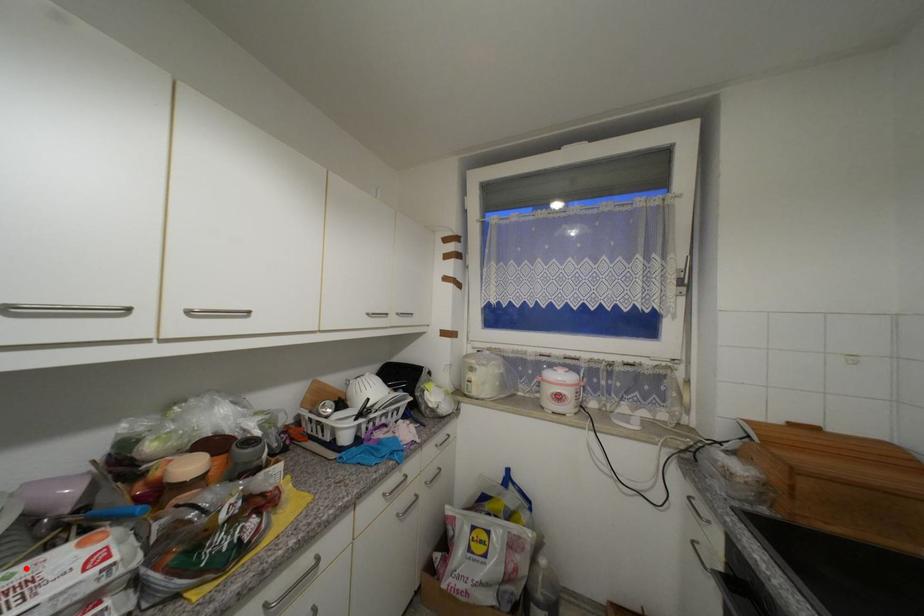
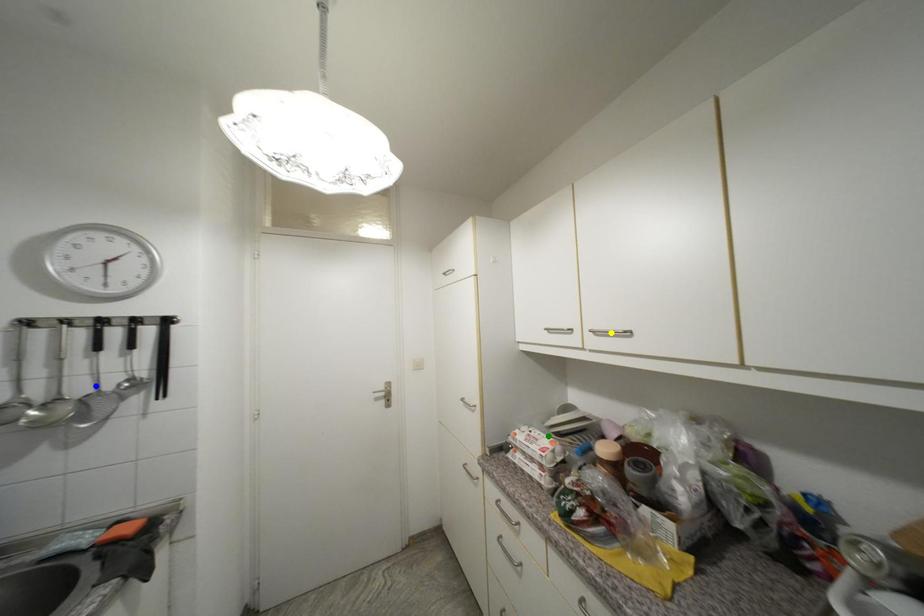
Question: I am providing you with two images of the same scene from different viewpoints. A red point is marked on the first image. You are given multiple points on the second image. Which spot in image 2 lines up with the point in image 1?

Choices:
 (A) yellow point
 (B) green point
 (C) blue point

Answer: (B)